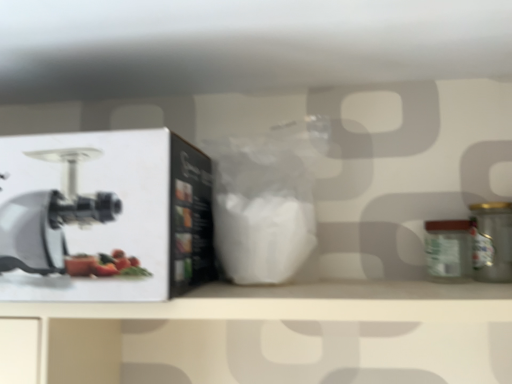
In order to face metallic gold canister at right, should I rotate leftwards or rightwards?

You should look right and rotate roughly 29.193 degrees.

Where is `white matte box at left`? The width and height of the screenshot is (512, 384). white matte box at left is located at coordinates (104, 216).

Which is closer to the camera, (455, 235) or (195, 247)?

Point (455, 235) appears to be farther away from the viewer than point (195, 247).

From a real-world perspective, relative to white matte box at left, is green matte glass jar at right vertically above or below?

Clearly, from a real-world perspective, green matte glass jar at right is below white matte box at left.

Is green matte glass jar at right to the right of white matte box at left from the viewer's perspective?

Indeed, green matte glass jar at right is positioned on the right side of white matte box at left.

Which of these two, green matte glass jar at right or white matte box at left, is thinner?

With smaller width is green matte glass jar at right.

Does point (40, 178) come closer to viewer compared to point (452, 251)?

Yes, point (40, 178) is closer to viewer.

From a real-world perspective, is white matte box at left on green matte glass jar at right?

Correct, in the physical world, white matte box at left is higher than green matte glass jar at right.

Could green matte glass jar at right be considered to be inside white matte box at left?

No, green matte glass jar at right is not surrounded by white matte box at left.

Can you tell me how much green matte glass jar at right and metallic gold canister at right differ in facing direction?

green matte glass jar at right and metallic gold canister at right are facing 0.000135 degrees away from each other.

Is green matte glass jar at right thinner than metallic gold canister at right?

Yes.

Is green matte glass jar at right not near metallic gold canister at right?

No, green matte glass jar at right is in close proximity to metallic gold canister at right.

From the picture: Is green matte glass jar at right aimed at metallic gold canister at right?

No, green matte glass jar at right is not turned towards metallic gold canister at right.

Considering the sizes of objects white matte box at left and metallic gold canister at right in the image provided, who is taller, white matte box at left or metallic gold canister at right?

With more height is white matte box at left.

From a real-world perspective, is white matte box at left under metallic gold canister at right?

No, from a real-world perspective, white matte box at left is not below metallic gold canister at right.

Consider the image. Which object is thinner, white matte box at left or metallic gold canister at right?

metallic gold canister at right is thinner.

Considering the points (35, 228) and (474, 252), which point is in front, point (35, 228) or point (474, 252)?

The point (35, 228) is in front.

Is metallic gold canister at right located outside white matte box at left?

Absolutely, metallic gold canister at right is external to white matte box at left.

Which is more to the right, metallic gold canister at right or white matte box at left?

From the viewer's perspective, metallic gold canister at right appears more on the right side.

Which of these two, metallic gold canister at right or white matte box at left, is smaller?

With smaller size is metallic gold canister at right.

Which object is further away from the camera, metallic gold canister at right or green matte glass jar at right?

green matte glass jar at right.

Considering the sizes of objects metallic gold canister at right and green matte glass jar at right in the image provided, who is shorter, metallic gold canister at right or green matte glass jar at right?

Standing shorter between the two is green matte glass jar at right.

Is metallic gold canister at right wider or thinner than green matte glass jar at right?

metallic gold canister at right is wider than green matte glass jar at right.

Looking at this image, does metallic gold canister at right turn towards green matte glass jar at right?

No.

Identify the location of wide above the green matte glass jar at right (from a real-world perspective). The width and height of the screenshot is (512, 384). (104, 216).

Find the location of `wide lying on the left of green matte glass jar at right`. wide lying on the left of green matte glass jar at right is located at coordinates (104, 216).

From the picture: Which object lies further to the anchor point metallic gold canister at right, green matte glass jar at right or white matte box at left?

white matte box at left is positioned further to the anchor metallic gold canister at right.

From the image, which object appears to be nearer to green matte glass jar at right, white matte box at left or metallic gold canister at right?

metallic gold canister at right is closer to green matte glass jar at right.

From the image, which object appears to be farther from green matte glass jar at right, metallic gold canister at right or white matte box at left?

white matte box at left is positioned further to the anchor green matte glass jar at right.

When comparing their distances from metallic gold canister at right, does white matte box at left or green matte glass jar at right seem closer?

green matte glass jar at right.

Estimate the real-world distances between objects in this image. Which object is further from white matte box at left, green matte glass jar at right or metallic gold canister at right?

metallic gold canister at right is further to white matte box at left.

Looking at the image, which one is located closer to white matte box at left, metallic gold canister at right or green matte glass jar at right?

Among the two, green matte glass jar at right is located nearer to white matte box at left.

Identify the location of glass jar between white matte box at left and metallic gold canister at right in the horizontal direction. This screenshot has width=512, height=384. (448, 250).